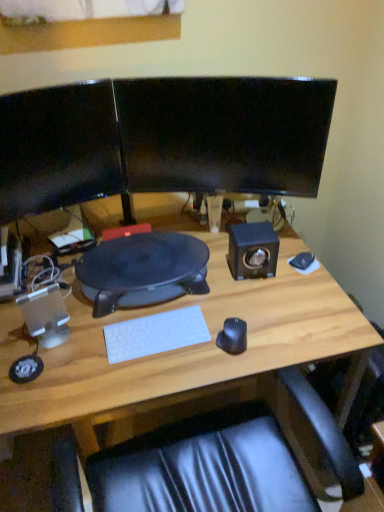
I want to click on empty space that is in between matte black speaker at right, the 2th speaker in the left-to-right sequence, and white matte keyboard at center, so click(209, 298).